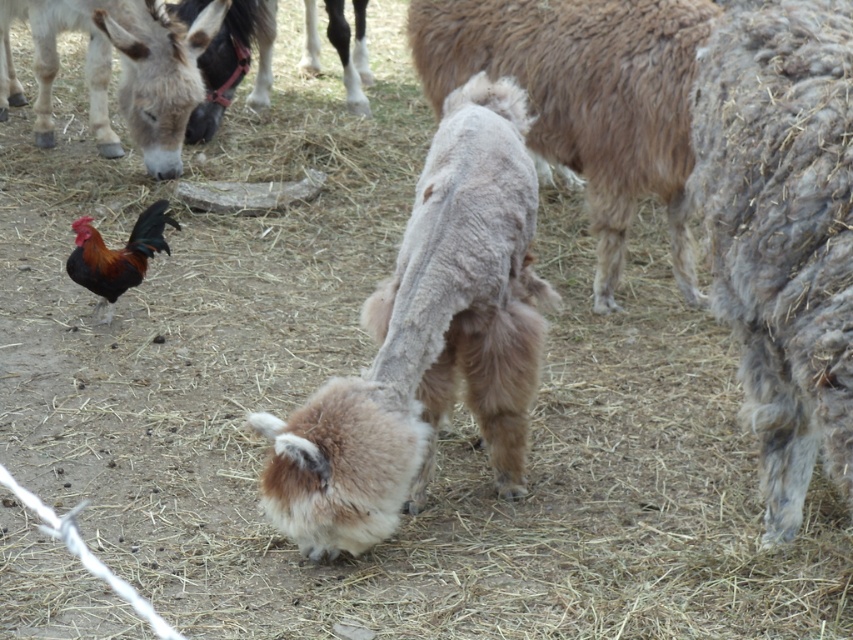
Question: Considering the relative positions of gray woolen sheep at center and fluffy brown sheep at center in the image provided, where is gray woolen sheep at center located with respect to fluffy brown sheep at center?

Choices:
 (A) below
 (B) above

Answer: (A)

Question: Estimate the real-world distances between objects in this image. Which object is closer to the shiny brown rooster at upper left?

Choices:
 (A) gray woolen sheep at center
 (B) fluffy brown sheep at center

Answer: (B)

Question: Which point appears closest to the camera in this image?

Choices:
 (A) (94, 307)
 (B) (610, 189)
 (C) (793, 396)

Answer: (C)

Question: Where is fluffy beige goat at center located in relation to shiny brown rooster at upper left in the image?

Choices:
 (A) left
 (B) right

Answer: (B)

Question: Which object is closer to the camera taking this photo?

Choices:
 (A) shiny brown rooster at upper left
 (B) fluffy beige goat at center
 (C) fluffy brown sheep at center

Answer: (B)

Question: Can you confirm if gray woolen sheep at center is wider than fluffy brown sheep at center?

Choices:
 (A) yes
 (B) no

Answer: (B)